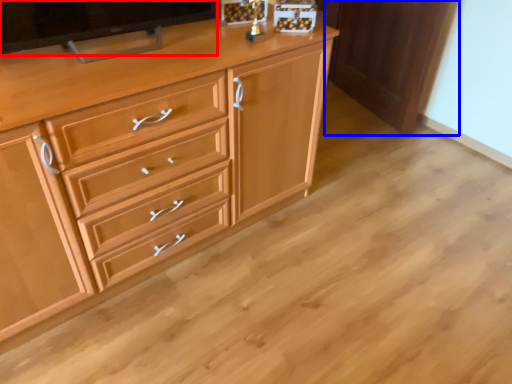
Question: Which object appears closest to the camera in this image, television (highlighted by a red box) or cabinetry (highlighted by a blue box)?

Choices:
 (A) television
 (B) cabinetry

Answer: (A)